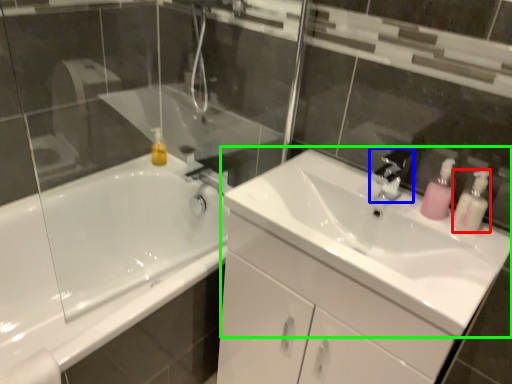
Question: Considering the real-world distances, which object is closest to soap dispenser (highlighted by a red box)? tap (highlighted by a blue box) or sink (highlighted by a green box).

Choices:
 (A) tap
 (B) sink

Answer: (A)